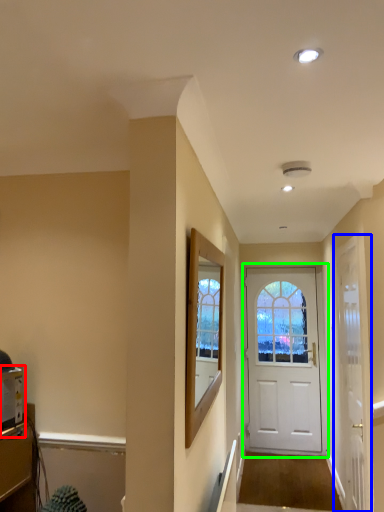
Question: Considering the real-world distances, which object is closest to appliance (highlighted by a red box)? door (highlighted by a blue box) or door (highlighted by a green box).

Choices:
 (A) door
 (B) door

Answer: (A)